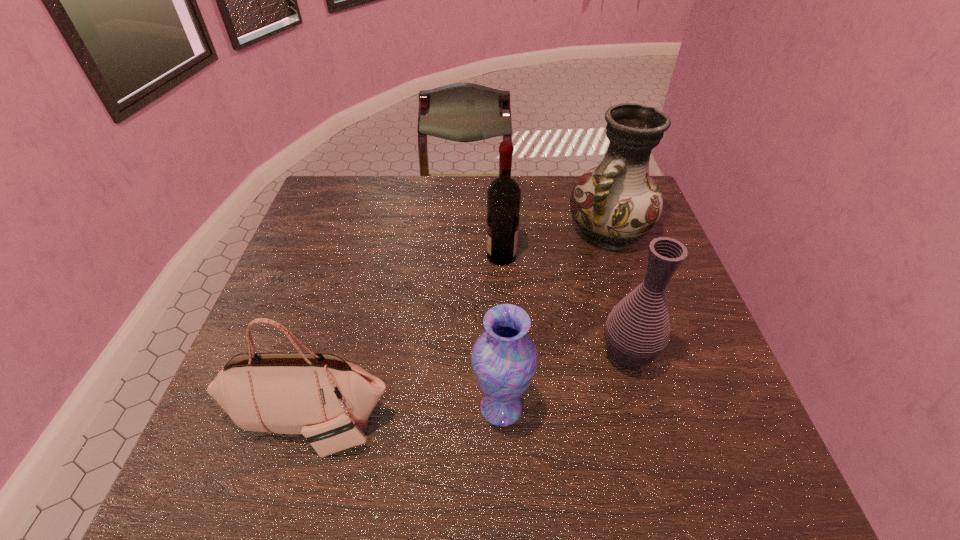
At what (x,y) coordinates should I click in order to perform the action: click on the farthest vase. Please return your answer as a coordinate pair (x, y). Looking at the image, I should click on (617, 202).

The height and width of the screenshot is (540, 960). Find the location of `alcohol`. alcohol is located at coordinates (504, 193).

Find the location of a particular element. This screenshot has width=960, height=540. the third farthest object is located at coordinates (637, 330).

Where is `the leftmost object`? the leftmost object is located at coordinates (328, 400).

Identify the location of the shortest vase. (504, 358).

The image size is (960, 540). Identify the location of the leftmost vase. (504, 358).

At what (x,y) coordinates should I click in order to perform the action: click on free space located on the left of the farthest vase. Please return your answer as a coordinate pair (x, y). The image size is (960, 540). Looking at the image, I should click on click(540, 231).

Locate an element on the screen. The height and width of the screenshot is (540, 960). vacant region located on the front and back of the alcohol is located at coordinates (439, 256).

Where is `vacant space located on the front and back of the alcohol`? The width and height of the screenshot is (960, 540). vacant space located on the front and back of the alcohol is located at coordinates (414, 256).

The height and width of the screenshot is (540, 960). In order to click on free space located on the front and back of the alcohol in this screenshot , I will do `click(392, 256)`.